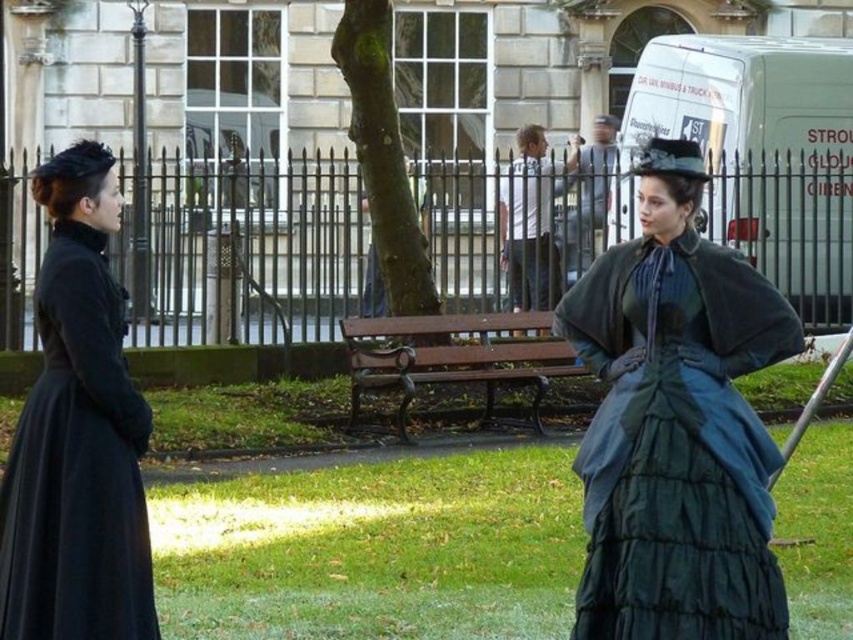
You are a photographer trying to capture a group photo of the velvet teal dress at center and the light gray shirt at center. Since you want to ensure both subjects are in focus, you need to know which one is taller. Can you tell me which one is taller?

The velvet teal dress at center is much taller than the light gray shirt at center, so you should adjust the camera angle to account for its height difference to ensure both are in focus.

You are planning to take a photo of the matte black dress at left and the wooden bench at center. Which object will appear smaller in the photo?

The matte black dress at left will appear smaller in the photo because it occupies less space than the wooden bench at center.